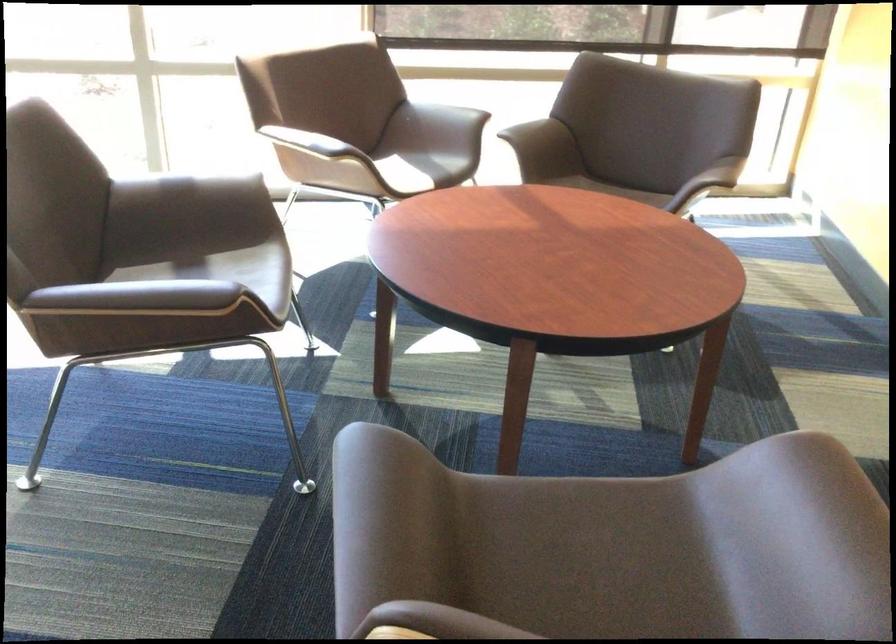
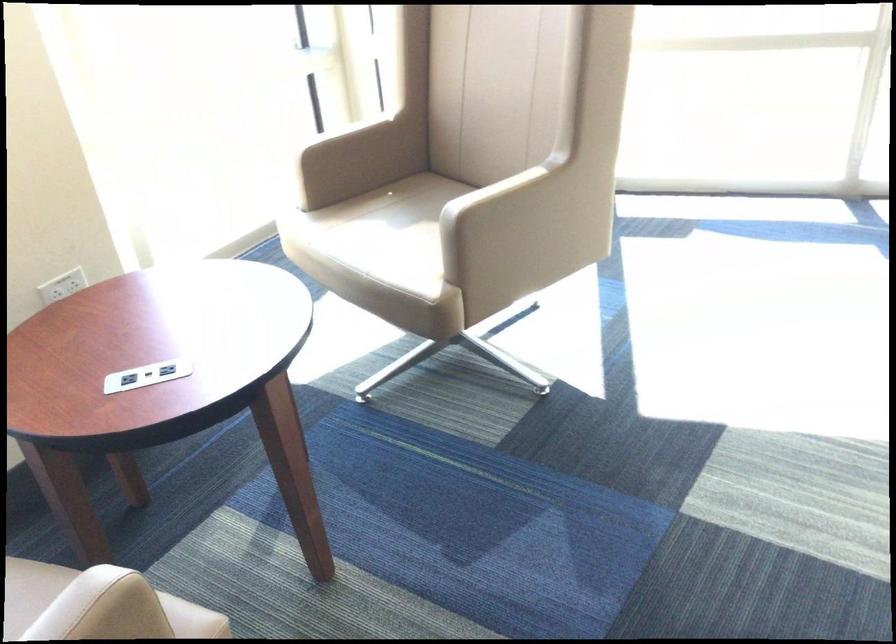
Question: In a continuous first-person perspective shot, in which direction is the camera moving?

Choices:
 (A) Left
 (B) Right
 (C) Forward
 (D) Backward

Answer: (A)